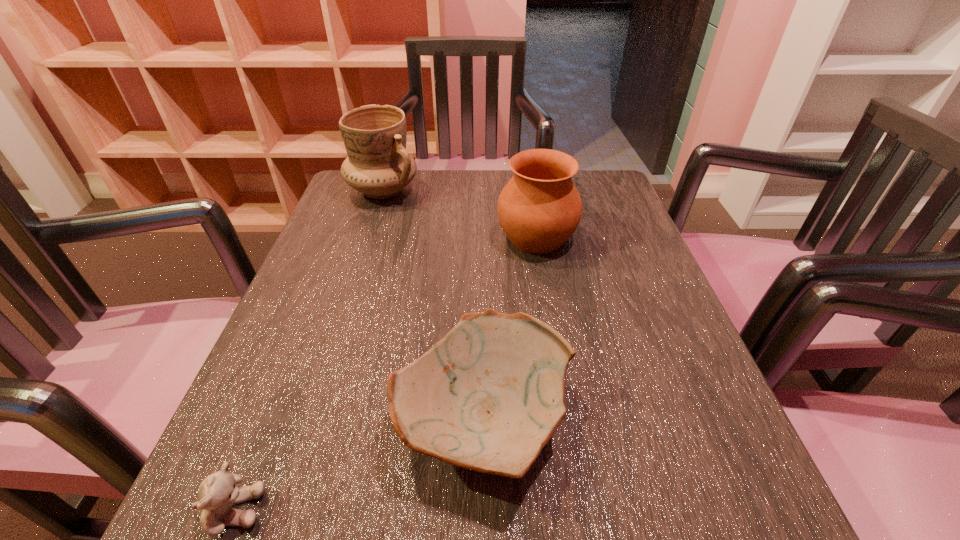
Where is `object that is at the right edge`? The height and width of the screenshot is (540, 960). object that is at the right edge is located at coordinates (539, 209).

The height and width of the screenshot is (540, 960). I want to click on object present at the far left corner, so click(378, 164).

Locate an element on the screen. object that is at the far right corner is located at coordinates (539, 209).

Find the location of `vacant space at the far edge of the desktop`. vacant space at the far edge of the desktop is located at coordinates (429, 183).

Locate an element on the screen. The height and width of the screenshot is (540, 960). vacant space at the left edge of the desktop is located at coordinates (322, 243).

Where is `free space at the right edge of the desktop`? This screenshot has height=540, width=960. free space at the right edge of the desktop is located at coordinates (619, 338).

This screenshot has height=540, width=960. In order to click on vacant space at the far left corner of the desktop in this screenshot , I will do `click(340, 191)`.

The height and width of the screenshot is (540, 960). I want to click on vacant space at the far right corner of the desktop, so click(620, 195).

Locate an element on the screen. The image size is (960, 540). vacant space at the near right corner of the desktop is located at coordinates (741, 516).

The width and height of the screenshot is (960, 540). What are the coordinates of `free point between the second nearest pottery and the farthest object` in the screenshot? It's located at (460, 214).